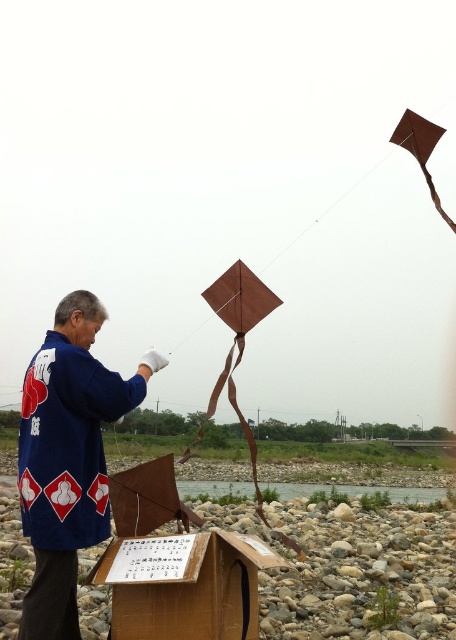
Does blue fabric jacket at center have a lesser height compared to brown matte kite at upper right?

Yes, blue fabric jacket at center is shorter than brown matte kite at upper right.

Does blue fabric jacket at center appear over brown matte kite at upper right?

No, blue fabric jacket at center is not above brown matte kite at upper right.

The height and width of the screenshot is (640, 456). Describe the element at coordinates (67, 458) in the screenshot. I see `blue fabric jacket at center` at that location.

Image resolution: width=456 pixels, height=640 pixels. I want to click on blue fabric jacket at center, so (x=67, y=458).

Can you confirm if brown cardboard box at lower center is shorter than brown matte kite at upper right?

Indeed, brown cardboard box at lower center has a lesser height compared to brown matte kite at upper right.

Consider the image. Is brown cardboard box at lower center bigger than brown matte kite at upper right?

No.

Measure the distance between brown cardboard box at lower center and camera.

A distance of 8.59 feet exists between brown cardboard box at lower center and camera.

Find the location of a particular element. brown cardboard box at lower center is located at coordinates click(188, 586).

Can you confirm if blue fabric jacket at center is smaller than brown cardboard box at lower center?

No.

Who is higher up, blue fabric jacket at center or brown cardboard box at lower center?

blue fabric jacket at center is above.

What are the coordinates of `blue fabric jacket at center` in the screenshot? It's located at (67, 458).

The height and width of the screenshot is (640, 456). Find the location of `blue fabric jacket at center`. blue fabric jacket at center is located at coordinates (67, 458).